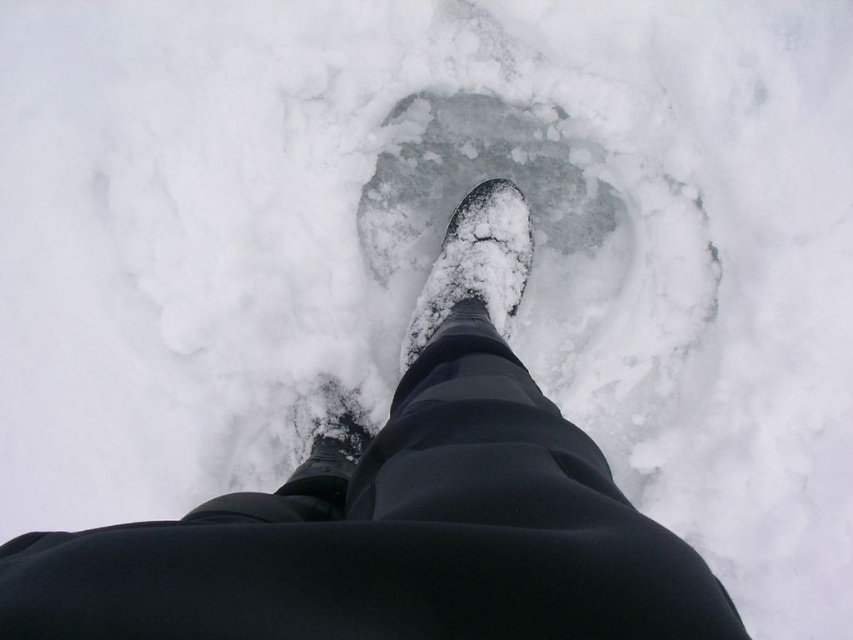
You are a photographer trying to capture the texture of the snow in the image. You have two points of interest marked as point [119,532] and point [479,310]. Which point do you think is better for focusing on to show the snow texture up close?

Point [119,532] is closer to the camera than point [479,310], so focusing on point [119,532] would better show the snow texture up close.

You are a delivery robot with a 16 inch wide package. You need to navigate between the shiny black boot at center and the matte black boot at lower center. Can you fit through the space between them?

The shiny black boot at center is 15.38 inches away from the matte black boot at lower center. Since the package is 16 inches wide, it is slightly wider than the available space, so the robot cannot fit through the space between them.